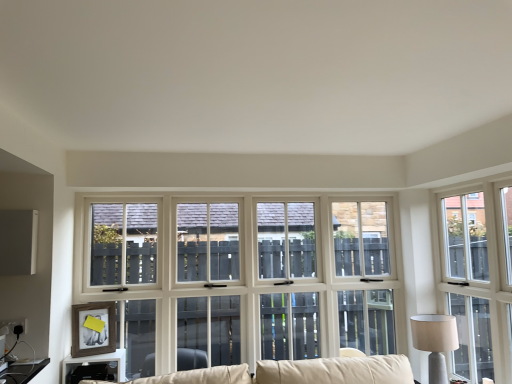
Question: In the image, is beige fabric lampshade at right positioned in front of or behind white wood window at right?

Choices:
 (A) behind
 (B) front

Answer: (A)

Question: From a real-world perspective, is beige fabric lampshade at right above or below white wood window at right?

Choices:
 (A) below
 (B) above

Answer: (A)

Question: Estimate the real-world distances between objects in this image. Which object is closer to the matte black table at lower left?

Choices:
 (A) beige fabric lampshade at right
 (B) white wood window at right

Answer: (A)

Question: Which is farther from the white wood window at right?

Choices:
 (A) matte black table at lower left
 (B) beige fabric lampshade at right

Answer: (A)